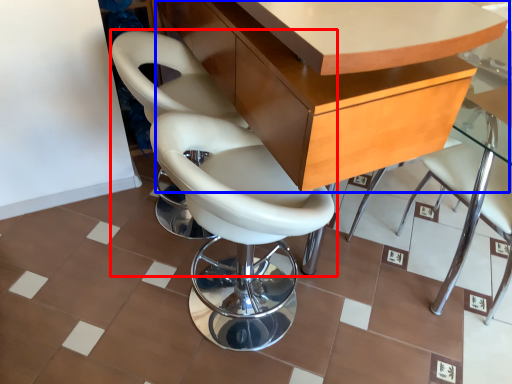
Question: Which object is closer to the camera taking this photo, chair (highlighted by a red box) or table (highlighted by a blue box)?

Choices:
 (A) chair
 (B) table

Answer: (B)